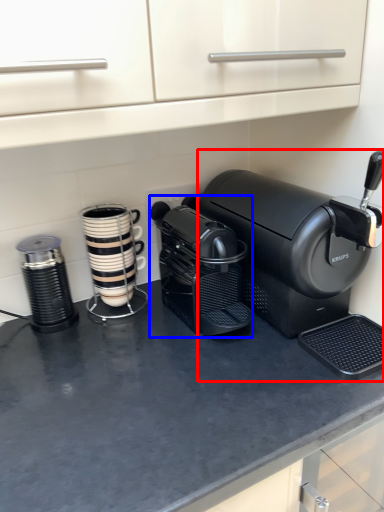
Question: Which object appears closest to the camera in this image, coffee maker (highlighted by a red box) or coffee maker (highlighted by a blue box)?

Choices:
 (A) coffee maker
 (B) coffee maker

Answer: (A)